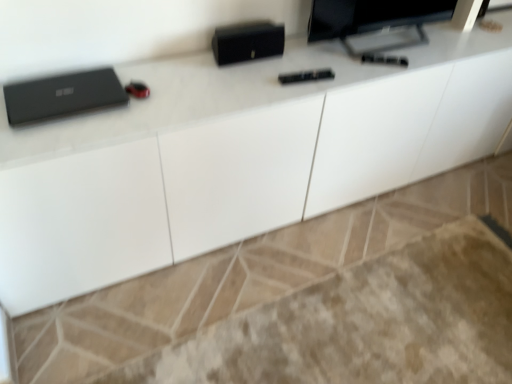
Question: Considering the positions of matte black monitor at upper right and matte black laptop at left in the image, is matte black monitor at upper right bigger or smaller than matte black laptop at left?

Choices:
 (A) big
 (B) small

Answer: (A)

Question: From a real-world perspective, is matte black monitor at upper right positioned above or below matte black laptop at left?

Choices:
 (A) above
 (B) below

Answer: (A)

Question: From the image's perspective, relative to matte black laptop at left, is matte black monitor at upper right above or below?

Choices:
 (A) above
 (B) below

Answer: (A)

Question: Which is correct: matte black laptop at left is inside matte black monitor at upper right, or outside of it?

Choices:
 (A) inside
 (B) outside

Answer: (B)

Question: Looking at the image, does matte black laptop at left seem bigger or smaller compared to matte black monitor at upper right?

Choices:
 (A) big
 (B) small

Answer: (B)

Question: Is matte black laptop at left wider or thinner than matte black monitor at upper right?

Choices:
 (A) thin
 (B) wide

Answer: (B)

Question: From a real-world perspective, is matte black laptop at left positioned above or below matte black monitor at upper right?

Choices:
 (A) above
 (B) below

Answer: (B)